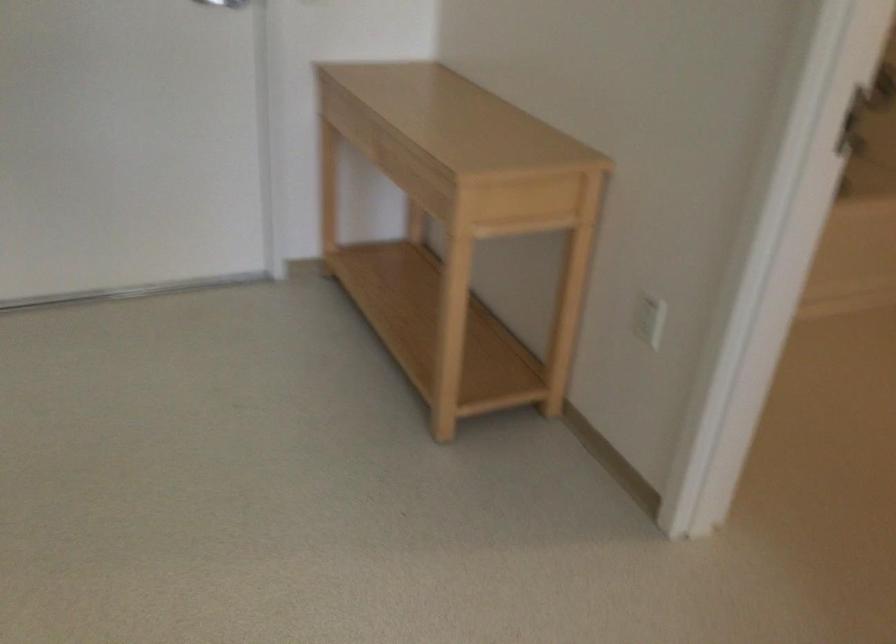
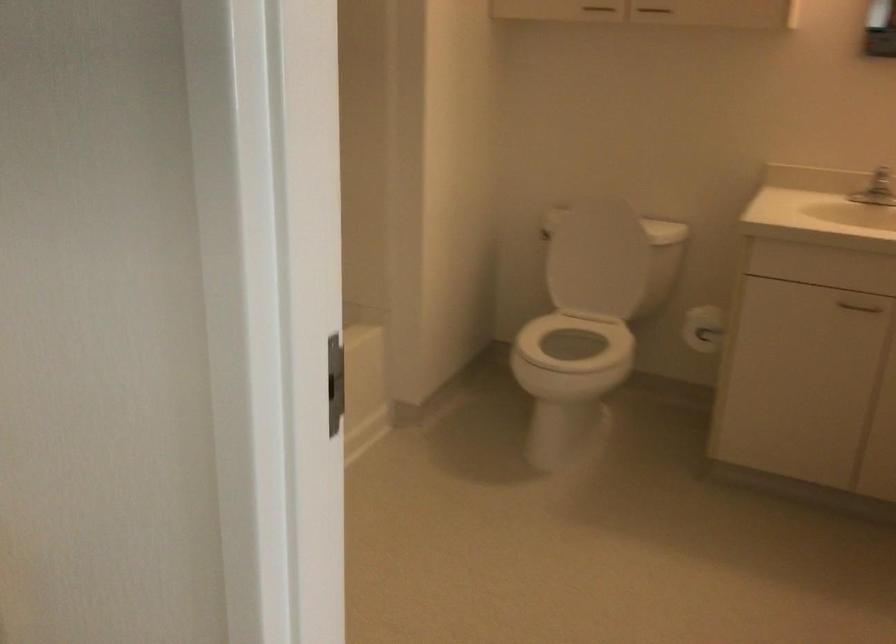
Question: Based on the continuous images, in which direction is the camera rotating? Reply with the corresponding letter.

Choices:
 (A) Left
 (B) Right
 (C) Up
 (D) Down

Answer: (B)